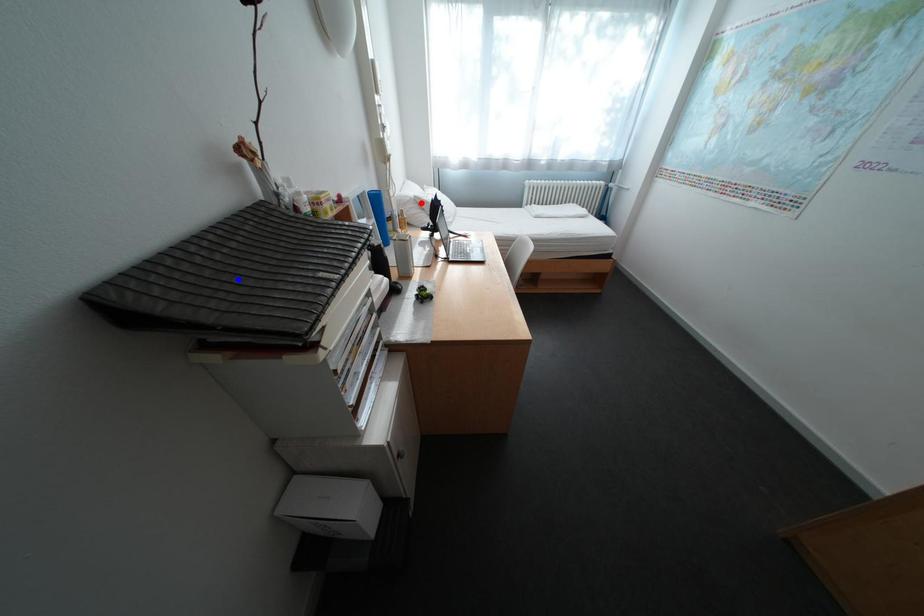
Question: Which of the two points in the image is closer to the camera?

Choices:
 (A) Blue point is closer.
 (B) Red point is closer.

Answer: (A)